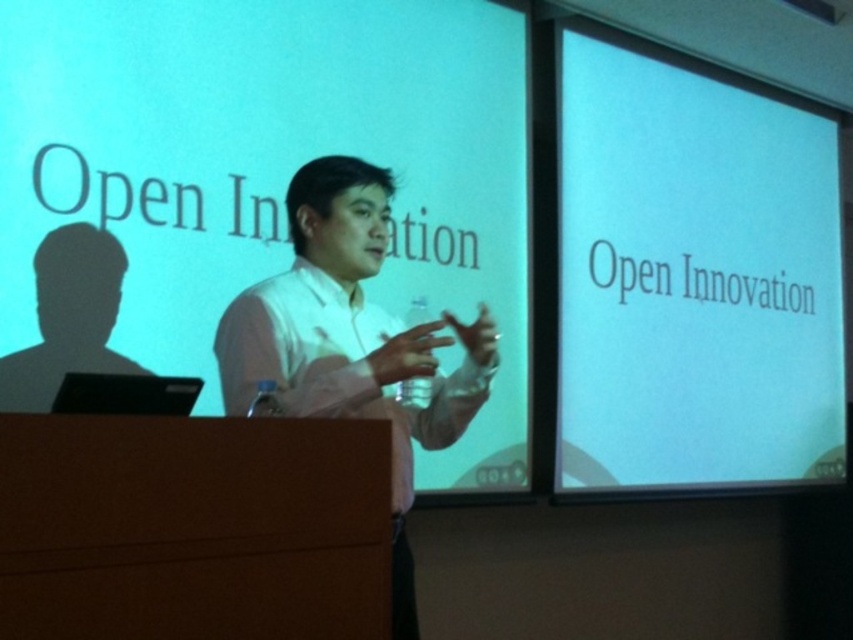
Question: Considering the real-world distances, which object is farthest from the matte white screen at upper center?

Choices:
 (A) black matte silhouette at left
 (B) white matte projection screen at upper right
 (C) white shirt at center

Answer: (B)

Question: Is matte white screen at upper center below black matte silhouette at left?

Choices:
 (A) no
 (B) yes

Answer: (A)

Question: Which point is farther to the camera?

Choices:
 (A) (51, 387)
 (B) (741, 340)
 (C) (271, 113)

Answer: (B)

Question: Can you confirm if matte white screen at upper center is positioned below white shirt at center?

Choices:
 (A) yes
 (B) no

Answer: (B)

Question: Which point appears closest to the camera in this image?

Choices:
 (A) [x=248, y=362]
 (B) [x=91, y=284]
 (C) [x=170, y=221]

Answer: (A)

Question: In this image, where is matte white screen at upper center located relative to white shirt at center?

Choices:
 (A) left
 (B) right

Answer: (A)